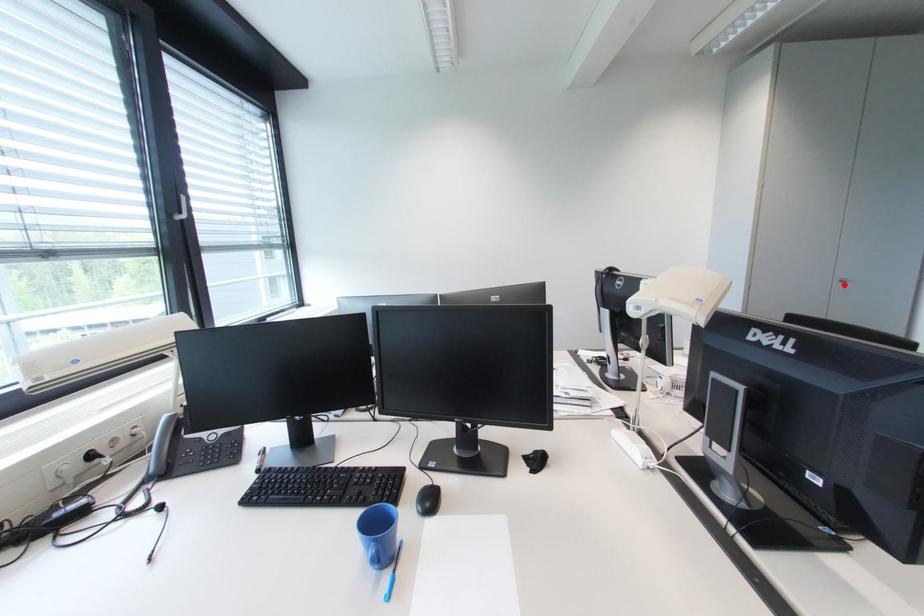
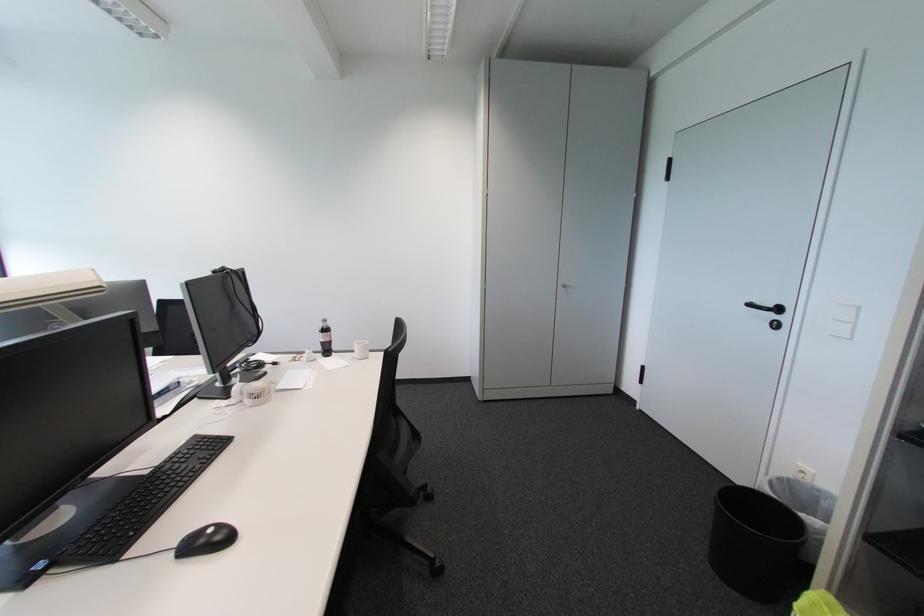
Find the pixel in the second image that matches the highlighted location in the first image.

(567, 290)